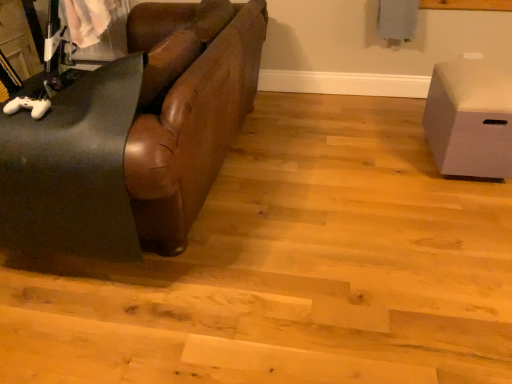
Find the location of a particular element. brown leather couch at left is located at coordinates (134, 137).

The width and height of the screenshot is (512, 384). What do you see at coordinates (134, 137) in the screenshot? I see `brown leather couch at left` at bounding box center [134, 137].

What is the approximate width of brown leather couch at left?

It is 3.60 feet.

The height and width of the screenshot is (384, 512). In order to click on white matte storage box at right in this screenshot , I will do `click(470, 119)`.

What do you see at coordinates (470, 119) in the screenshot? The image size is (512, 384). I see `white matte storage box at right` at bounding box center [470, 119].

Looking at this image, measure the distance between point (x=444, y=137) and camera.

Point (x=444, y=137) and camera are 7.73 feet apart from each other.

Image resolution: width=512 pixels, height=384 pixels. Find the location of `brown leather couch at left`. brown leather couch at left is located at coordinates (134, 137).

In the scene shown: In the image, is white matte storage box at right on the left side or the right side of brown leather couch at left?

white matte storage box at right is positioned on brown leather couch at left's right side.

Between white matte storage box at right and brown leather couch at left, which one is positioned behind?

white matte storage box at right is behind.

Which point is more forward, (436, 102) or (64, 203)?

The point (64, 203) is closer.

From the image's perspective, is white matte storage box at right above brown leather couch at left?

No.

From a real-world perspective, is white matte storage box at right positioned above or below brown leather couch at left?

In terms of real-world spatial position, white matte storage box at right is below brown leather couch at left.

Which of these two, white matte storage box at right or brown leather couch at left, is thinner?

Thinner between the two is white matte storage box at right.

Which of these two, white matte storage box at right or brown leather couch at left, stands shorter?

white matte storage box at right.

Is white matte storage box at right smaller than brown leather couch at left?

Correct, white matte storage box at right occupies less space than brown leather couch at left.

Is white matte storage box at right situated inside brown leather couch at left or outside?

white matte storage box at right exists outside the volume of brown leather couch at left.

Can you see white matte storage box at right touching brown leather couch at left?

No, white matte storage box at right is not in contact with brown leather couch at left.

Is white matte storage box at right facing away from brown leather couch at left?

white matte storage box at right is not turned away from brown leather couch at left.

How many degrees apart are the facing directions of white matte storage box at right and brown leather couch at left?

The facing directions of white matte storage box at right and brown leather couch at left are 92.5 degrees apart.

Find the location of a particular element. The width and height of the screenshot is (512, 384). studio couch located in front of the white matte storage box at right is located at coordinates (134, 137).

Is brown leather couch at left to the left or to the right of white matte storage box at right in the image?

Based on their positions, brown leather couch at left is located to the left of white matte storage box at right.

Considering the positions of objects brown leather couch at left and white matte storage box at right in the image provided, who is behind, brown leather couch at left or white matte storage box at right?

white matte storage box at right is further away from the camera.

Is point (39, 192) less distant than point (464, 103)?

Yes, point (39, 192) is in front of point (464, 103).

From the image's perspective, is brown leather couch at left over white matte storage box at right?

Yes, from the image's perspective, brown leather couch at left is on top of white matte storage box at right.

From a real-world perspective, is brown leather couch at left above or below white matte storage box at right?

Clearly, from a real-world perspective, brown leather couch at left is above white matte storage box at right.

Considering the sizes of objects brown leather couch at left and white matte storage box at right in the image provided, who is wider, brown leather couch at left or white matte storage box at right?

With larger width is brown leather couch at left.

Considering the relative sizes of brown leather couch at left and white matte storage box at right in the image provided, is brown leather couch at left taller than white matte storage box at right?

Correct, brown leather couch at left is much taller as white matte storage box at right.

Which of these two, brown leather couch at left or white matte storage box at right, is bigger?

brown leather couch at left is bigger.

Is brown leather couch at left outside of white matte storage box at right?

Yes, brown leather couch at left is not within white matte storage box at right.

Looking at this image, is brown leather couch at left in contact with white matte storage box at right?

No, brown leather couch at left is not beside white matte storage box at right.

Is brown leather couch at left aimed at white matte storage box at right?

No, brown leather couch at left is not oriented towards white matte storage box at right.

In the scene shown: How far apart are brown leather couch at left and white matte storage box at right?

brown leather couch at left is 4.57 feet away from white matte storage box at right.

Locate an element on the screen. studio couch above the white matte storage box at right (from a real-world perspective) is located at coordinates (134, 137).

You are a GUI agent. You are given a task and a screenshot of the screen. Output one action in this format:
    pyautogui.click(x=<x>, y=<y>)
    Task: Click on the studio couch on the left of white matte storage box at right
    The width and height of the screenshot is (512, 384).
    Given the screenshot: What is the action you would take?
    pyautogui.click(x=134, y=137)

Find the location of `studio couch in front of the white matte storage box at right`. studio couch in front of the white matte storage box at right is located at coordinates (134, 137).